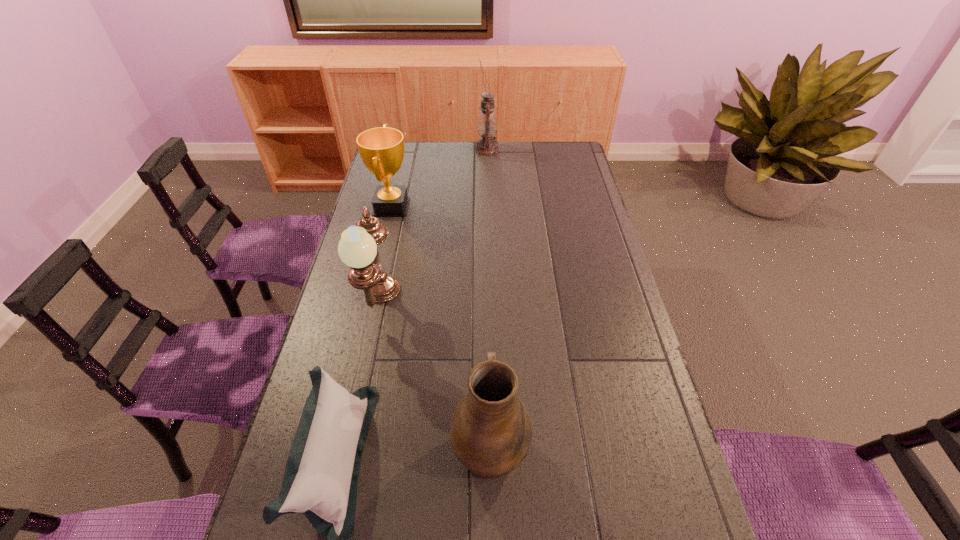
Locate an element on the screen. The image size is (960, 540). vacant space located 0.280m on the handle side of the pitcher is located at coordinates (488, 319).

Identify the location of blank area located on the front-facing side of the award. 435,207.

This screenshot has width=960, height=540. I want to click on object situated at the far edge, so click(x=487, y=125).

Where is `oil lamp that is at the left edge`? oil lamp that is at the left edge is located at coordinates (357, 248).

Identify the location of award that is positioned at the left edge. (382, 149).

The height and width of the screenshot is (540, 960). In order to click on vacant space at the far edge in this screenshot , I will do `click(440, 157)`.

Find the location of a particular element. The height and width of the screenshot is (540, 960). vacant area at the left edge is located at coordinates (366, 347).

The image size is (960, 540). Find the location of `vacant area at the right edge of the desktop`. vacant area at the right edge of the desktop is located at coordinates (582, 202).

This screenshot has width=960, height=540. Find the location of `free region at the far left corner`. free region at the far left corner is located at coordinates (407, 145).

The height and width of the screenshot is (540, 960). Find the location of `vacant space that's between the farther oil lamp and the second farthest object`. vacant space that's between the farther oil lamp and the second farthest object is located at coordinates (440, 178).